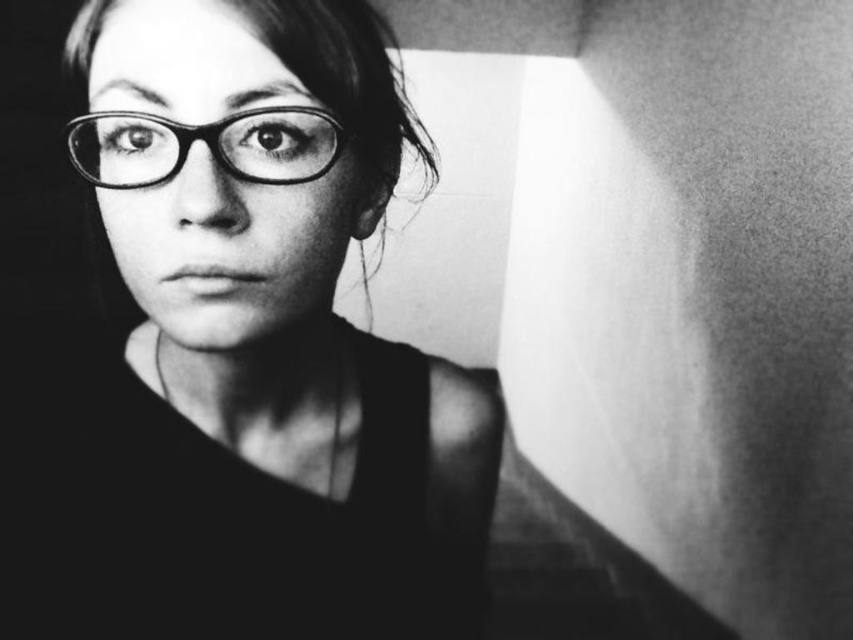
Between matte black glasses at upper left and matte black glasses at center, which one is positioned higher?

matte black glasses at center

At what (x,y) coordinates should I click in order to perform the action: click on matte black glasses at upper left. Please return your answer as a coordinate pair (x, y). Looking at the image, I should click on (242, 356).

Where is `matte black glasses at upper left`? matte black glasses at upper left is located at coordinates (242, 356).